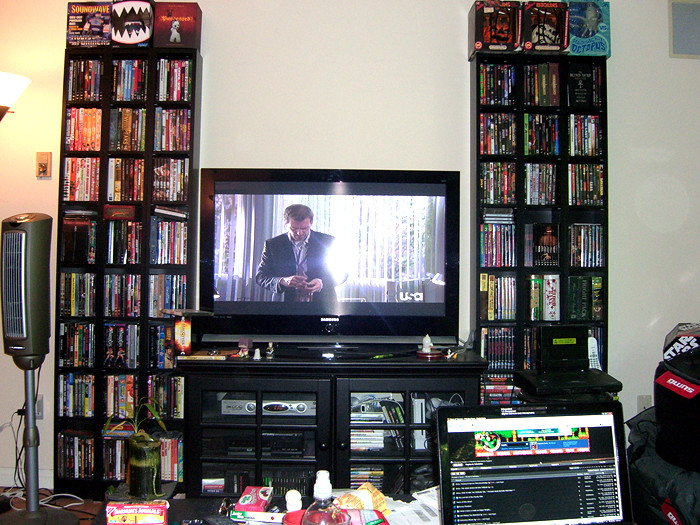
I want to click on left of tv, so click(x=171, y=110).